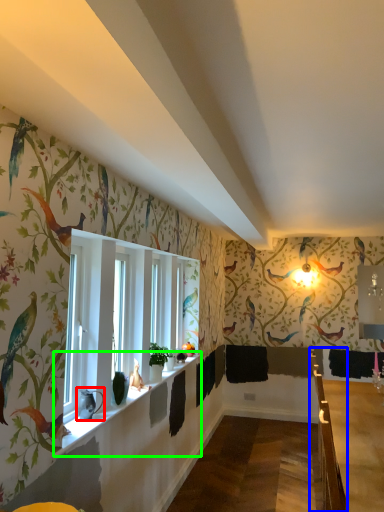
Question: Based on their relative distances, which object is farther from animal (highlighted by a red box)? Choose from rail (highlighted by a blue box) and window sill (highlighted by a green box).

Choices:
 (A) rail
 (B) window sill

Answer: (A)